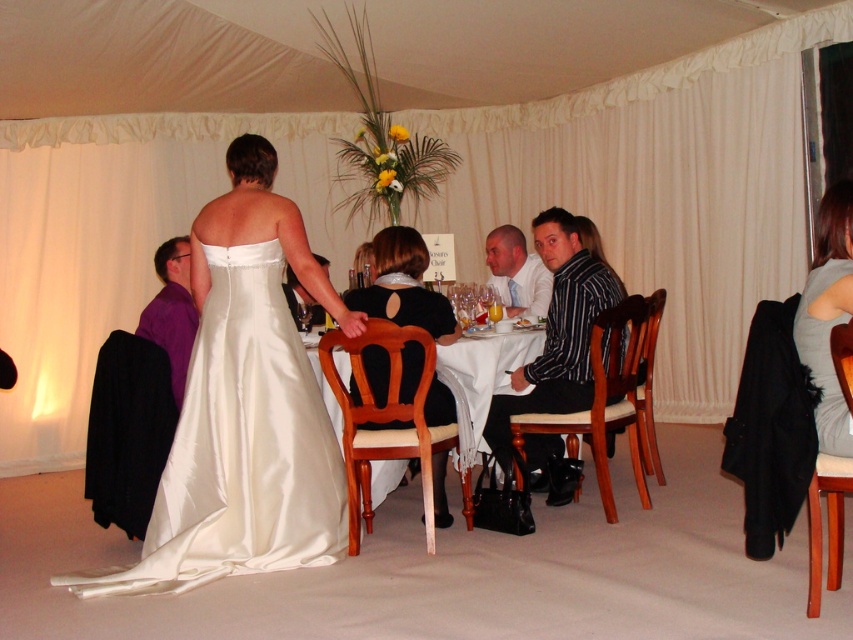
You are a photographer at the wedding reception. You need to capture a photo of the black satin dress at center and the purple satin shirt at left. Based on their positions, which one is more to the right?

The black satin dress at center is more to the right because it is positioned on the right side of the purple satin shirt at left.

You are a photographer at the wedding reception. You need to place two decorative lights at the coordinates point (180, 557) and point (399, 396). Which point is closer to the camera so that you can adjust the lighting accordingly?

Point (180, 557) is closer to the viewer than point (399, 396), so you should adjust the lighting for that point first to ensure proper illumination.

You are a photographer at the wedding reception. You want to capture a photo of the black satin dress at center and the purple satin shirt at left. Based on their sizes, which one should you focus on to ensure it stands out more in the photo?

The black satin dress at center is larger in size than the purple satin shirt at left, so focusing on the black satin dress at center would make it stand out more in the photo.